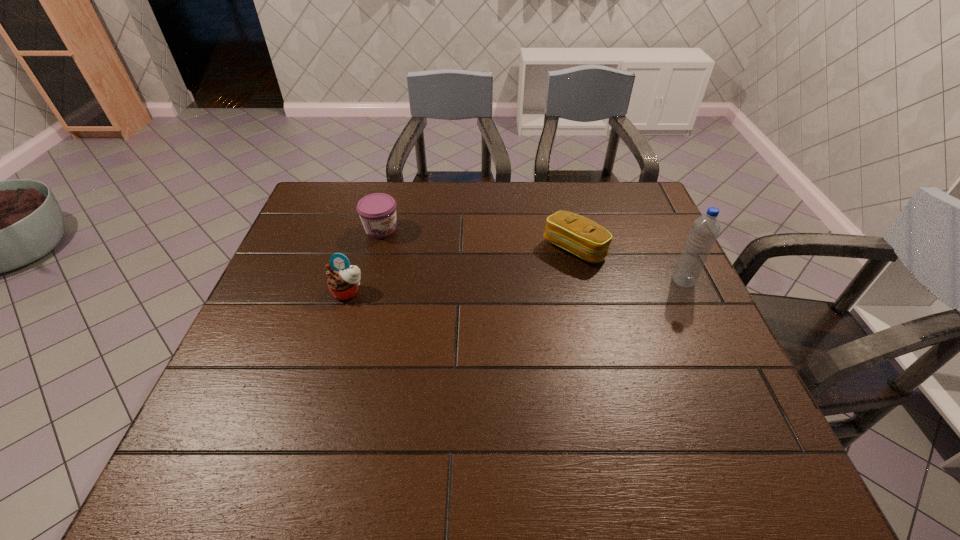
Where is `free space on the desktop that is between the muffin and the tallest object and is positioned on the front label of the jam`? The height and width of the screenshot is (540, 960). free space on the desktop that is between the muffin and the tallest object and is positioned on the front label of the jam is located at coordinates (482, 287).

Locate an element on the screen. free space on the desktop that is between the second tallest object and the tallest object and is positioned on the zipper side of the second object from right to left is located at coordinates (522, 286).